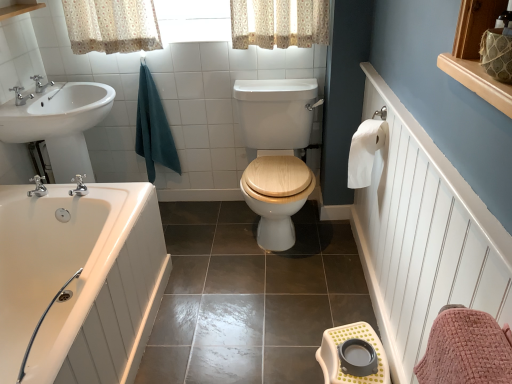
Question: Visually, is wooden at center positioned to the left or to the right of silver metallic faucet at upper left, placed as the first tap when sorted from bottom to top?

Choices:
 (A) right
 (B) left

Answer: (A)

Question: Looking at the image, does wooden at center seem bigger or smaller compared to silver metallic faucet at upper left, the first tap positioned from the front?

Choices:
 (A) small
 (B) big

Answer: (B)

Question: Which is farther from the white wood balustrade at upper left?

Choices:
 (A) white glossy bathtub at lower left
 (B) white paper at right
 (C) brushed metal faucet at upper left, positioned as the 2th tap in bottom-to-top order
 (D) silver metallic faucet at upper left, the first tap positioned from the front
 (E) wooden at center

Answer: (B)

Question: Which is nearer to the white glossy bathtub at lower left?

Choices:
 (A) teal cotton towel at upper left
 (B) brushed metal faucet at upper left, the first tap when ordered from back to front
 (C) silver metallic faucet at upper left, the first tap positioned from the front
 (D) white glossy sink at left
 (E) wooden at center

Answer: (E)